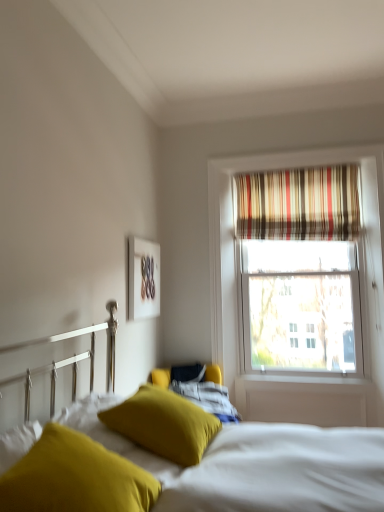
Question: Is mustard yellow fabric pillow at center, placed as the second pillow when sorted from front to back, in front of or behind mustard yellow fabric pillow at lower left, placed as the second pillow when sorted from back to front, in the image?

Choices:
 (A) behind
 (B) front

Answer: (A)

Question: Is point (135, 434) positioned closer to the camera than point (104, 464)?

Choices:
 (A) farther
 (B) closer

Answer: (A)

Question: Which object is the closest to the soft yellow pillow at lower left?

Choices:
 (A) white matte picture frame at upper center
 (B) striped fabric curtain at upper right
 (C) mustard yellow fabric pillow at lower left, placed as the second pillow when sorted from back to front
 (D) mustard yellow fabric pillow at center, placed as the second pillow when sorted from front to back

Answer: (D)

Question: Which object is positioned farthest from the striped fabric curtain at upper right?

Choices:
 (A) mustard yellow fabric pillow at center, placed as the second pillow when sorted from front to back
 (B) white matte picture frame at upper center
 (C) soft yellow pillow at lower left
 (D) mustard yellow fabric pillow at lower left, placed as the second pillow when sorted from back to front

Answer: (D)